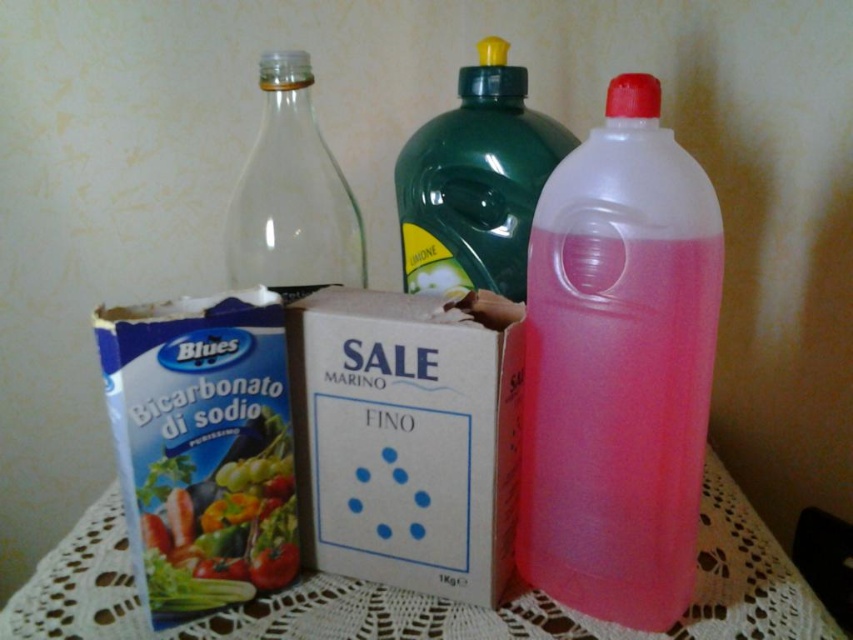
Question: Does translucent plastic bottle at right have a lesser width compared to white lace tablecloth at lower center?

Choices:
 (A) no
 (B) yes

Answer: (B)

Question: Which point is closer to the camera taking this photo?

Choices:
 (A) (234, 246)
 (B) (494, 97)
 (C) (106, 394)
 (D) (369, 365)

Answer: (C)

Question: Estimate the real-world distances between objects in this image. Which object is farther from the blue cardboard box at left?

Choices:
 (A) translucent plastic bottle at right
 (B) green matte vegetable at left
 (C) white lace tablecloth at lower center

Answer: (A)

Question: Among these points, which one is farthest from the camera?

Choices:
 (A) (741, 618)
 (B) (270, 518)
 (C) (177, 536)
 (D) (512, 148)

Answer: (D)

Question: Considering the relative positions of green matte vegetable at left and transparent glass bottle at center in the image provided, where is green matte vegetable at left located with respect to transparent glass bottle at center?

Choices:
 (A) left
 (B) right

Answer: (A)

Question: Is blue cardboard box at left closer to camera compared to green matte vegetable at left?

Choices:
 (A) yes
 (B) no

Answer: (A)